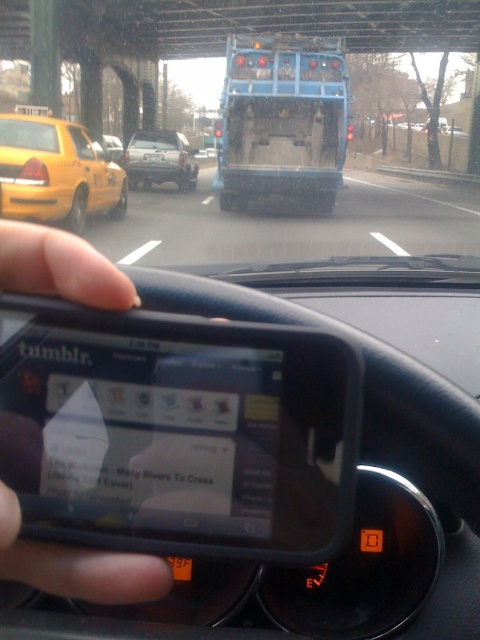
Who is lower down, black matte phone at center or yellow matte taxi at left?

black matte phone at center is lower down.

How distant is black matte phone at center from yellow matte taxi at left?

black matte phone at center and yellow matte taxi at left are 10.81 meters apart.

Is point (59, 595) more distant than point (72, 228)?

That is False.

Where is `black matte phone at center`? The width and height of the screenshot is (480, 640). black matte phone at center is located at coordinates (76, 564).

Can you confirm if black matte phone at center is positioned above yellow matte taxi cab at left?

No, black matte phone at center is not above yellow matte taxi cab at left.

Where is `black matte phone at center`? black matte phone at center is located at coordinates (76, 564).

You are a GUI agent. You are given a task and a screenshot of the screen. Output one action in this format:
    pyautogui.click(x=<x>, y=<y>)
    Task: Click on the black matte phone at center
    This screenshot has height=640, width=480.
    Given the screenshot: What is the action you would take?
    pyautogui.click(x=76, y=564)

Is yellow matte taxi at left to the right of matte silver truck at center from the viewer's perspective?

Incorrect, yellow matte taxi at left is not on the right side of matte silver truck at center.

Between yellow matte taxi at left and matte silver truck at center, which one is positioned lower?

Positioned lower is yellow matte taxi at left.

Which is in front, point (71, 154) or point (162, 160)?

Point (71, 154) is more forward.

Find the location of `yellow matte taxi at left`. yellow matte taxi at left is located at coordinates (56, 172).